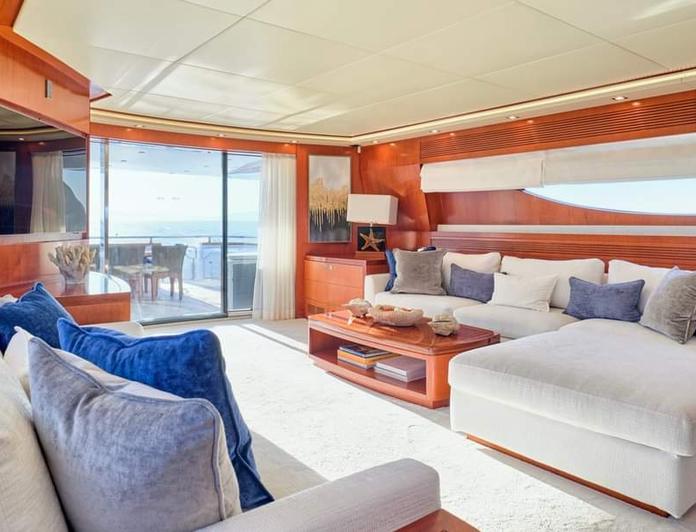
Identify the location of coffee table. (410, 352).